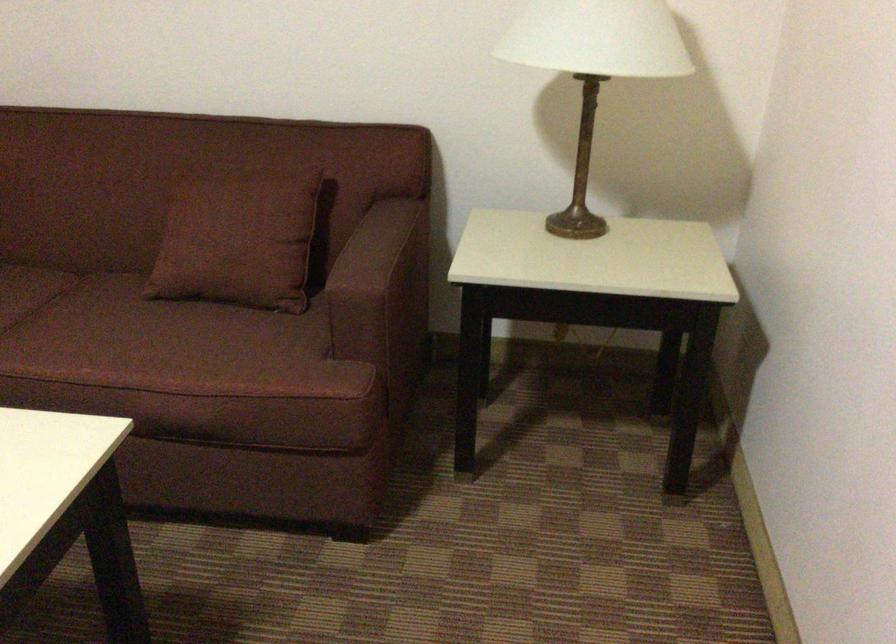
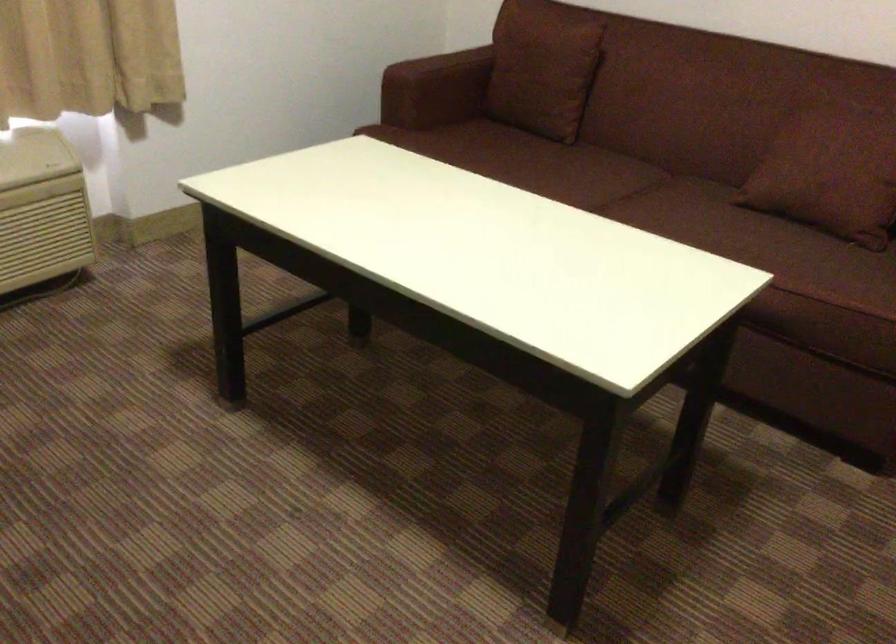
The point at [252,286] is marked in the first image. Where is the corresponding point in the second image?

(842, 207)